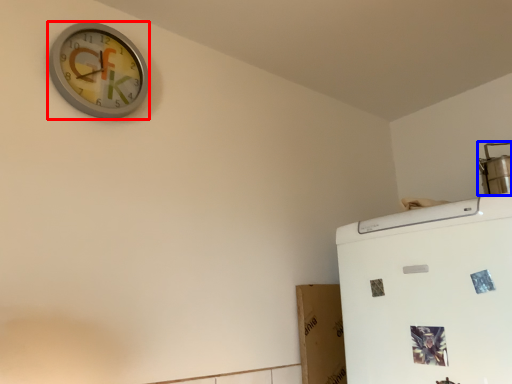
Question: Which object appears farthest to the camera in this image, wall clock (highlighted by a red box) or appliance (highlighted by a blue box)?

Choices:
 (A) wall clock
 (B) appliance

Answer: (B)